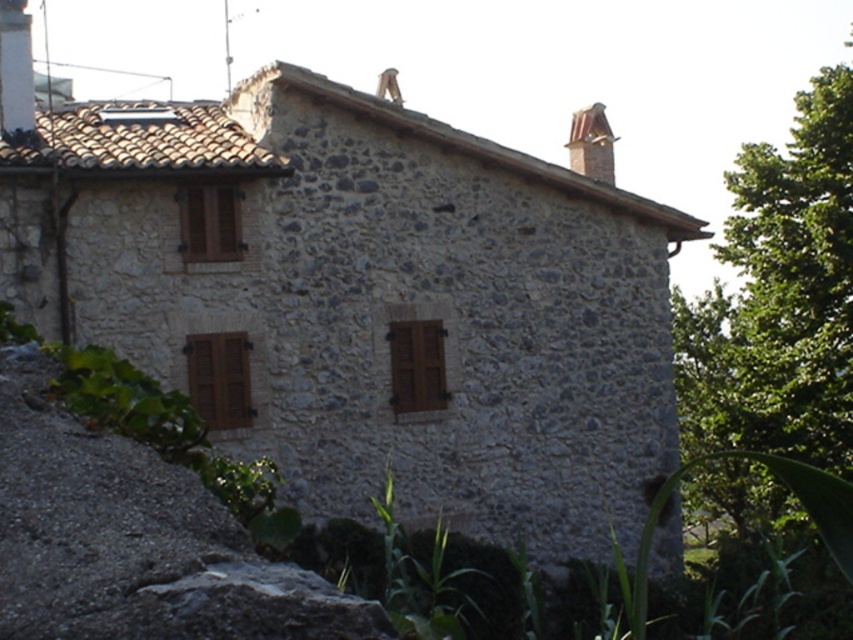
Question: Which point is closer to the camera?

Choices:
 (A) white stone chimney at upper left
 (B) smooth terracotta chimney at upper right
 (C) gray rough stone at center
 (D) green leafy tree at right

Answer: (C)

Question: Does gray rough stone at center have a greater width compared to white stone chimney at upper left?

Choices:
 (A) no
 (B) yes

Answer: (B)

Question: Which point is closer to the camera taking this photo?

Choices:
 (A) (601, 125)
 (B) (756, 323)

Answer: (B)

Question: Is white stone chimney at upper left bigger than smooth terracotta chimney at upper right?

Choices:
 (A) no
 (B) yes

Answer: (A)

Question: Based on their relative distances, which object is farther from the gray rough stone at center?

Choices:
 (A) smooth terracotta chimney at upper right
 (B) green leafy tree at right
 (C) white stone chimney at upper left

Answer: (B)

Question: Does gray rough stone at center have a greater width compared to smooth terracotta chimney at upper right?

Choices:
 (A) no
 (B) yes

Answer: (B)